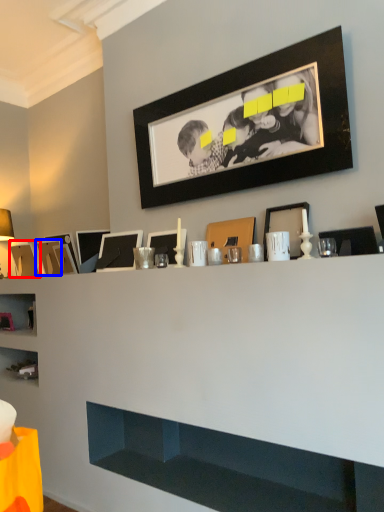
Question: Which point is closer to the camera, picture frame (highlighted by a red box) or picture frame (highlighted by a blue box)?

Choices:
 (A) picture frame
 (B) picture frame

Answer: (B)